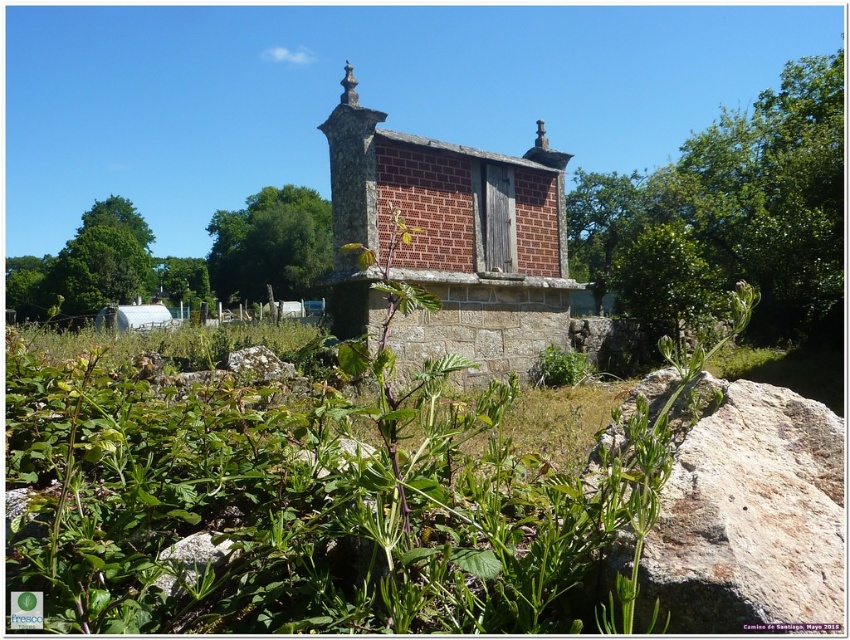
Question: Is green leafy tree at center above green leafy tree at lower left?

Choices:
 (A) yes
 (B) no

Answer: (A)

Question: Can you confirm if brown brick church at center is thinner than green leafy tree at center?

Choices:
 (A) no
 (B) yes

Answer: (B)

Question: Estimate the real-world distances between objects in this image. Which object is closer to the green leafy tree at center?

Choices:
 (A) green leafy tree at upper center
 (B) green leafy tree at lower left

Answer: (B)

Question: Is brown brick church at center bigger than green leafy tree at lower left?

Choices:
 (A) no
 (B) yes

Answer: (A)

Question: Which of the following is the farthest from the observer?

Choices:
 (A) brown brick church at center
 (B) green leafy tree at lower left
 (C) green leafy tree at center
 (D) green leafy tree at upper center

Answer: (C)

Question: Which point appears farthest from the camera in this image?

Choices:
 (A) (672, 195)
 (B) (178, 276)
 (C) (314, 284)

Answer: (B)